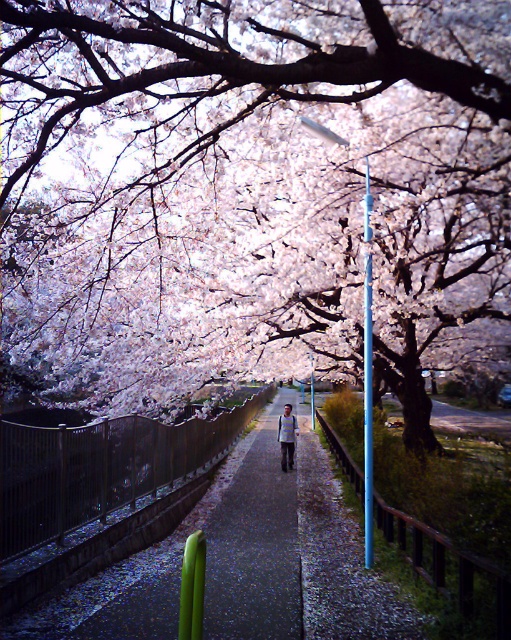
Based on the photo, does smooth plastic pole at center lie behind light blue striped shirt at center?

That is False.

Does smooth plastic pole at center have a greater width compared to light blue striped shirt at center?

Correct, the width of smooth plastic pole at center exceeds that of light blue striped shirt at center.

Who is more forward, (367, 371) or (285, 444)?

Point (367, 371) is in front.

Locate an element on the screen. smooth plastic pole at center is located at coordinates (367, 376).

Who is shorter, fluffy pink blossoms at center or light blue striped shirt at center?

light blue striped shirt at center is shorter.

Can you confirm if fluffy pink blossoms at center is shorter than light blue striped shirt at center?

Incorrect, fluffy pink blossoms at center's height does not fall short of light blue striped shirt at center's.

What do you see at coordinates (250, 188) in the screenshot?
I see `fluffy pink blossoms at center` at bounding box center [250, 188].

This screenshot has width=511, height=640. What are the coordinates of `fluffy pink blossoms at center` in the screenshot? It's located at (250, 188).

Does fluffy pink blossoms at center appear on the right side of smooth plastic pole at center?

No, fluffy pink blossoms at center is not to the right of smooth plastic pole at center.

Is fluffy pink blossoms at center bigger than smooth plastic pole at center?

Correct, fluffy pink blossoms at center is larger in size than smooth plastic pole at center.

Is point (383, 380) positioned after point (368, 483)?

Yes.

Locate an element on the screen. This screenshot has width=511, height=640. fluffy pink blossoms at center is located at coordinates (250, 188).